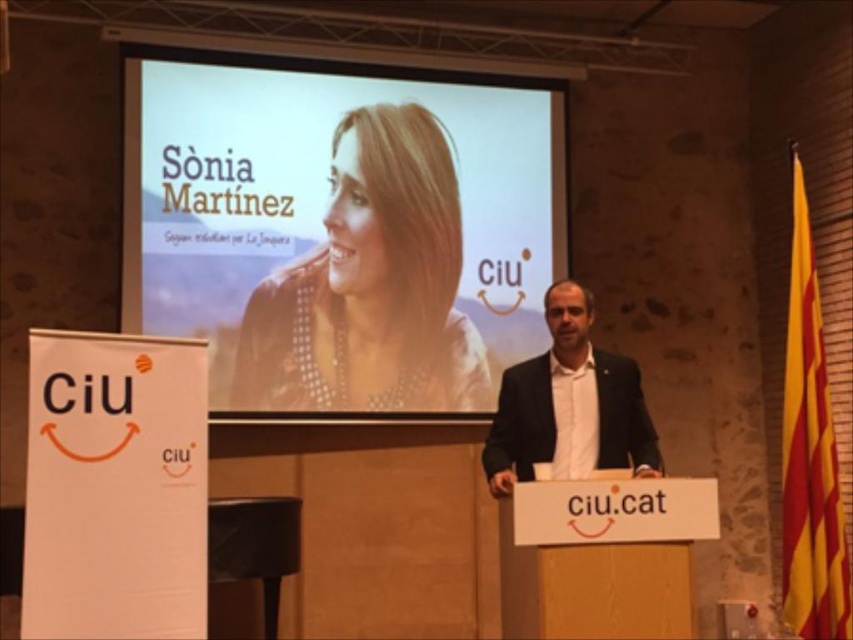
You are attending a formal event and notice two items of clothing on the speaker. The smooth beige blouse at upper center and the dark suit at center. Which one is closer to you?

The smooth beige blouse at upper center is closer to you because it is positioned further to the viewer than the dark suit at center.

You are attending a formal event and notice two clothing items on the speaker. The smooth beige blouse at upper center and the dark suit at center. Which clothing item appears bigger in size?

The smooth beige blouse at upper center is larger in size than the dark suit at center.